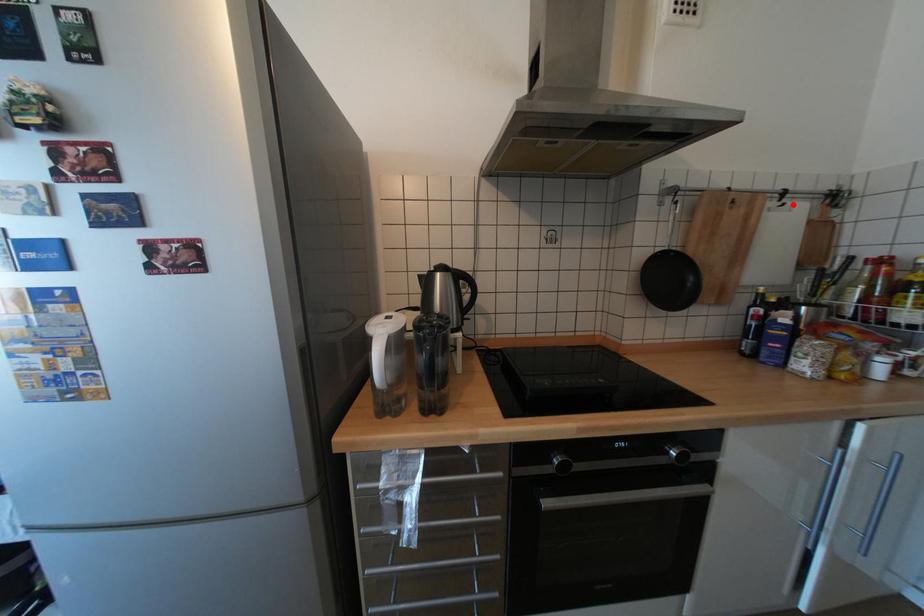
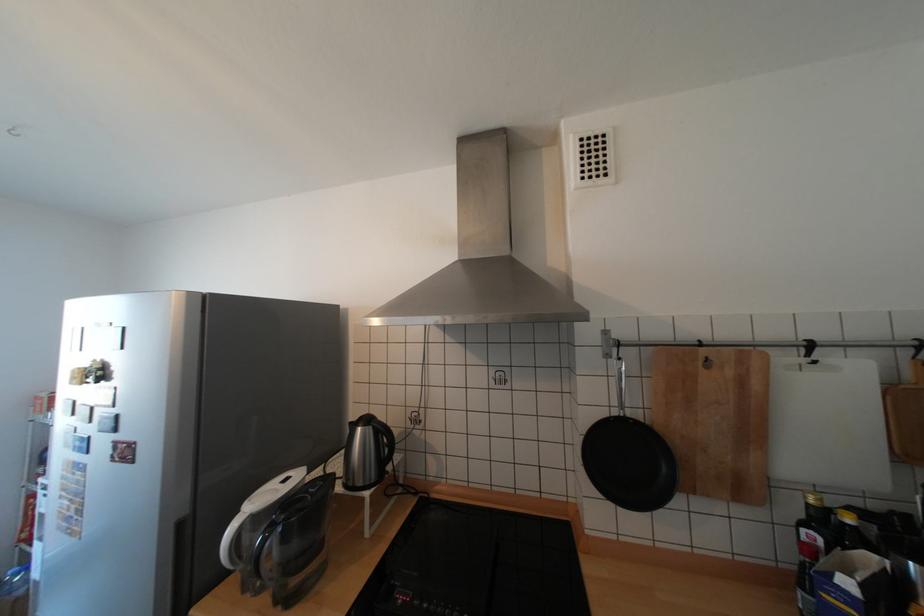
The point at the highlighted location is marked in the first image. Where is the corresponding point in the second image?

(823, 362)